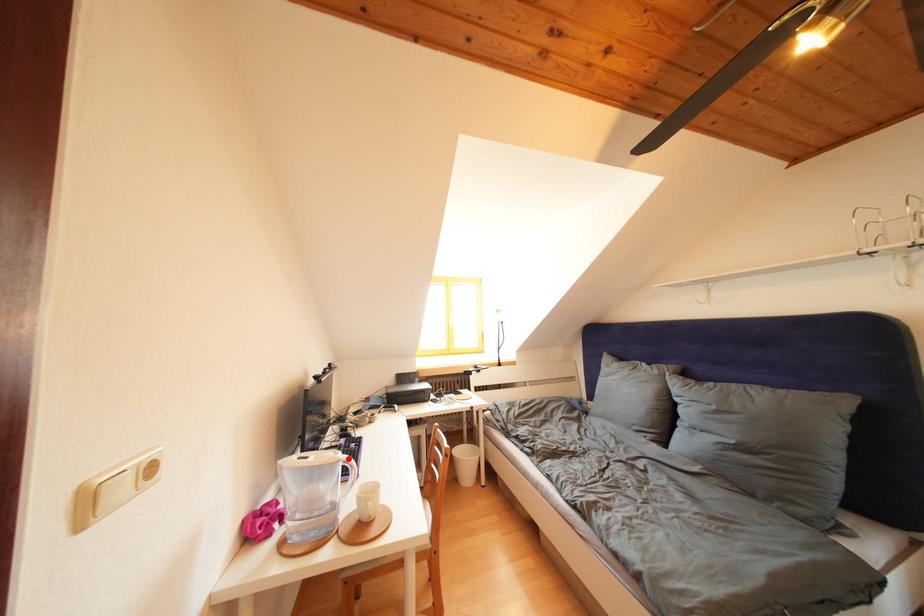
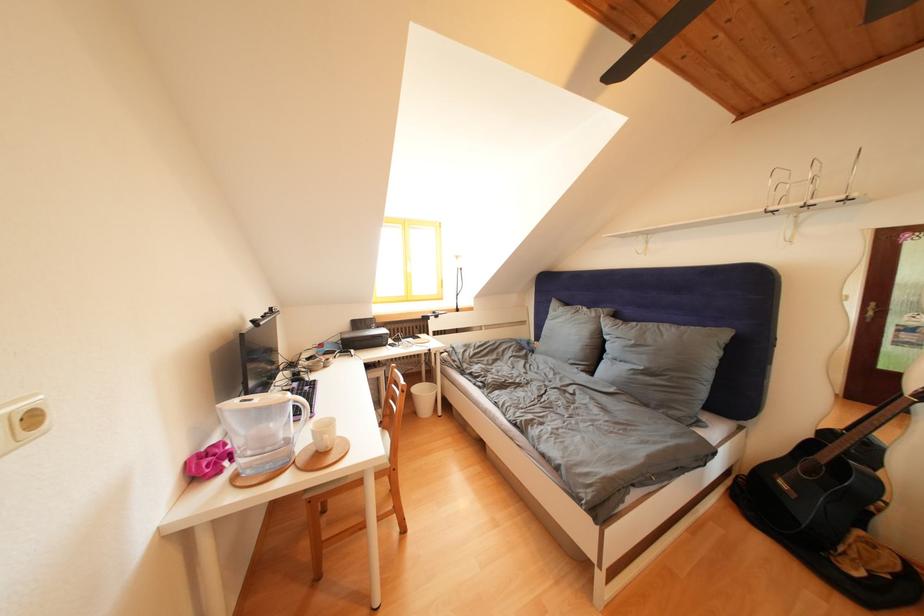
The point at the highlighted location is marked in the first image. Where is the corresponding point in the second image?

(297, 400)